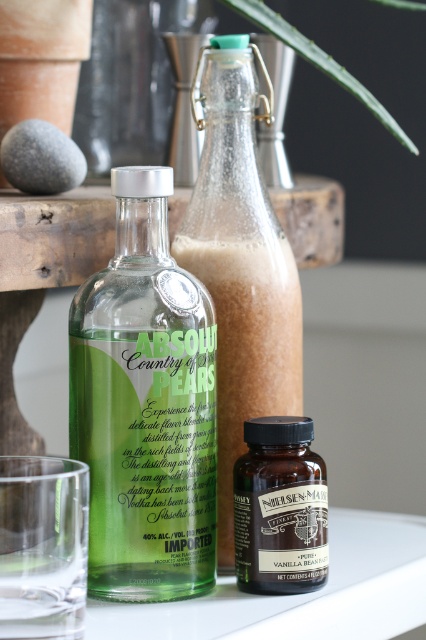
You are a bartender preparing a drink and need to place a clear glass bottle at center and a green leafy plant at upper center on a shelf. The shelf is only 5 inches wide. Can both items fit side by side without overlapping?

The clear glass bottle at center is 4.21 inches from the green leafy plant at upper center, so yes, both items can fit side by side on the 5 inch wide shelf since the total required space is less than 5 inches.

From the picture: You are a bartender preparing a drink and need to reach for the green glass bottle at center. If your hand is 12 inches long, can you comfortably grasp it without moving your elbow?

The green glass bottle at center is 16.25 inches away from the viewer. Since your hand is only 12 inches long, you cannot comfortably reach it without moving your elbow.